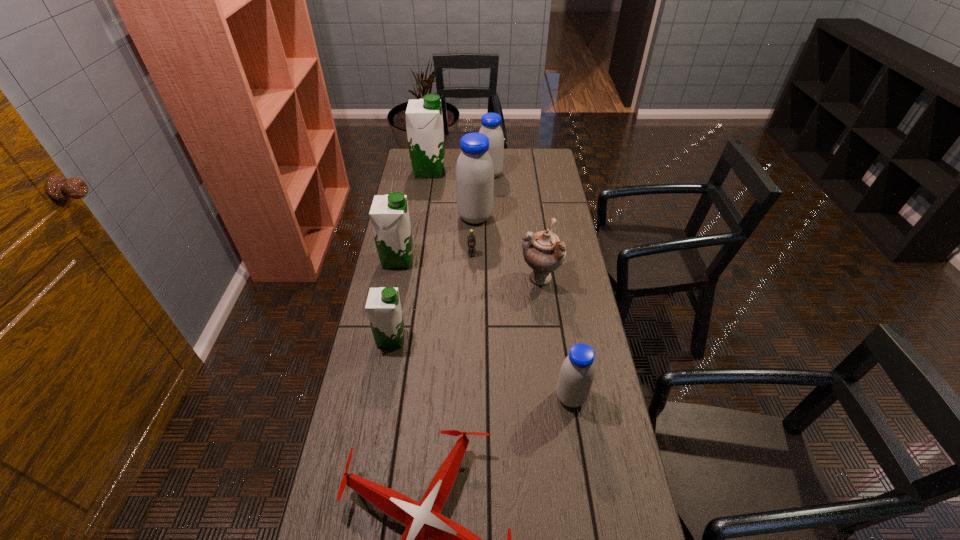
Identify the location of empty location between the nearest soya milk and the smallest green soya milk. point(481,368).

The height and width of the screenshot is (540, 960). Identify the location of vacant area that lies between the second biggest green soya milk and the second nearest object. click(x=484, y=328).

The width and height of the screenshot is (960, 540). What are the coordinates of `vacant point located between the soda and the fifth farthest soya milk` in the screenshot? It's located at (431, 296).

Locate an element on the screen. the sixth closest object relative to the second farthest green soya milk is located at coordinates tap(491, 122).

This screenshot has width=960, height=540. I want to click on object that ranks as the seventh closest to the fourth farthest soya milk, so click(423, 520).

Identify which soya milk is the fourth nearest to the third nearest object. Please provide its 2D coordinates. Your answer should be formatted as a tuple, i.e. [(x, y)], where the tuple contains the x and y coordinates of a point satisfying the conditions above.

[(424, 121)]

Locate an element on the screen. The width and height of the screenshot is (960, 540). soya milk that stands as the sixth closest to the urn is located at coordinates (424, 121).

Locate an element on the screen. The height and width of the screenshot is (540, 960). the third closest green soya milk relative to the farthest blue soya milk is located at coordinates (383, 307).

Identify the location of green soya milk that is the second closest to the nearest green soya milk. (424, 121).

The image size is (960, 540). Find the location of `blue soya milk that stands as the third closest to the biggest green soya milk`. blue soya milk that stands as the third closest to the biggest green soya milk is located at coordinates (577, 372).